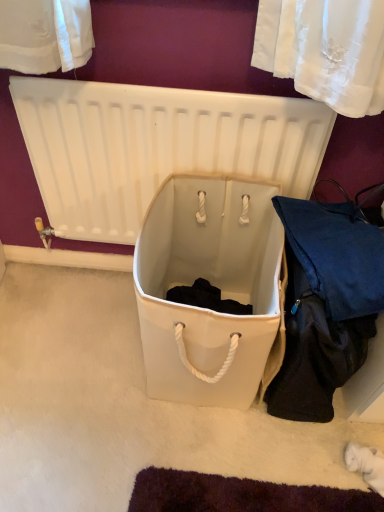
This screenshot has height=512, width=384. I want to click on white plastic radiator at center, so click(x=156, y=146).

At what (x,y) coordinates should I click in order to perform the action: click on white fabric storage box at center. Please return your answer as a coordinate pair (x, y). Looking at the image, I should click on (213, 284).

From a real-world perspective, is dark blue fabric at lower right under white plastic radiator at center?

Yes, from a real-world perspective, dark blue fabric at lower right is below white plastic radiator at center.

Does dark blue fabric at lower right have a lesser height compared to white plastic radiator at center?

Indeed, dark blue fabric at lower right has a lesser height compared to white plastic radiator at center.

Is dark blue fabric at lower right facing away from white plastic radiator at center?

Yes, dark blue fabric at lower right's orientation is away from white plastic radiator at center.

The width and height of the screenshot is (384, 512). Identify the location of clothing below the white plastic radiator at center (from a real-world perspective). (325, 304).

From a real-world perspective, is white plastic radiator at center positioned over dark blue fabric at lower right based on gravity?

Indeed, from a real-world perspective, white plastic radiator at center stands above dark blue fabric at lower right.

Which point is more distant from viewer, (258,133) or (326,292)?

The point (258,133) is farther.

Is white plastic radiator at center taller or shorter than dark blue fabric at lower right?

Considering their sizes, white plastic radiator at center has more height than dark blue fabric at lower right.

The width and height of the screenshot is (384, 512). I want to click on storage box on the left of dark blue fabric at lower right, so click(x=213, y=284).

From the picture: How far apart are dark blue fabric at lower right and white fabric storage box at center?

dark blue fabric at lower right and white fabric storage box at center are 17.71 centimeters apart from each other.

Could you tell me if dark blue fabric at lower right is facing white fabric storage box at center?

No, dark blue fabric at lower right is not turned towards white fabric storage box at center.

From a real-world perspective, which is physically below, dark blue fabric at lower right or white fabric storage box at center?

From a 3D spatial view, white fabric storage box at center is below.

From a real-world perspective, who is located lower, white fabric storage box at center or white plastic radiator at center?

white fabric storage box at center is physically lower.

Locate an element on the screen. The image size is (384, 512). storage box below the white plastic radiator at center (from the image's perspective) is located at coordinates 213,284.

Based on the photo, is white fabric storage box at center oriented away from white plastic radiator at center?

Absolutely, white fabric storage box at center is directed away from white plastic radiator at center.

Looking at this image, in terms of size, does white plastic radiator at center appear bigger or smaller than white fabric storage box at center?

white plastic radiator at center is smaller than white fabric storage box at center.

Would you say white plastic radiator at center is a long distance from white fabric storage box at center?

No, white plastic radiator at center is not far from white fabric storage box at center.

Is white plastic radiator at center aimed at white fabric storage box at center?

Yes, white plastic radiator at center is aimed at white fabric storage box at center.

Relative to white fabric storage box at center, is white plastic radiator at center in front or behind?

In the image, white plastic radiator at center appears behind white fabric storage box at center.

In the scene shown: Does white fabric storage box at center touch dark blue fabric at lower right?

No.

Considering the sizes of white fabric storage box at center and dark blue fabric at lower right in the image, is white fabric storage box at center taller or shorter than dark blue fabric at lower right?

Considering their sizes, white fabric storage box at center has less height than dark blue fabric at lower right.

Considering the points (157, 306) and (288, 378), which point is behind, point (157, 306) or point (288, 378)?

The point (288, 378) is farther.

Is dark blue fabric at lower right surrounded by white fabric storage box at center?

No, dark blue fabric at lower right is not a part of white fabric storage box at center.

Find the location of `radiator above the dark blue fabric at lower right (from the image's perspective)`. radiator above the dark blue fabric at lower right (from the image's perspective) is located at coordinates (156, 146).

You are a GUI agent. You are given a task and a screenshot of the screen. Output one action in this format:
    pyautogui.click(x=<x>, y=<y>)
    Task: Click on the clothing on the right side of white plastic radiator at center
    This screenshot has width=384, height=512.
    Given the screenshot: What is the action you would take?
    pyautogui.click(x=325, y=304)

When comparing their distances from white plastic radiator at center, does dark blue fabric at lower right or white fabric storage box at center seem further?

dark blue fabric at lower right.

Looking at the image, which one is located further to white plastic radiator at center, white fabric storage box at center or dark blue fabric at lower right?

Based on the image, dark blue fabric at lower right appears to be further to white plastic radiator at center.

Looking at the image, which one is located closer to dark blue fabric at lower right, white plastic radiator at center or white fabric storage box at center?

white fabric storage box at center.

Estimate the real-world distances between objects in this image. Which object is further from dark blue fabric at lower right, white fabric storage box at center or white plastic radiator at center?

white plastic radiator at center lies further to dark blue fabric at lower right than the other object.

Looking at the image, which one is located further to white fabric storage box at center, dark blue fabric at lower right or white plastic radiator at center?

white plastic radiator at center.

When comparing their distances from white fabric storage box at center, does white plastic radiator at center or dark blue fabric at lower right seem closer?

Among the two, dark blue fabric at lower right is located nearer to white fabric storage box at center.

This screenshot has width=384, height=512. What are the coordinates of `storage box between white plastic radiator at center and dark blue fabric at lower right from left to right` in the screenshot? It's located at (213, 284).